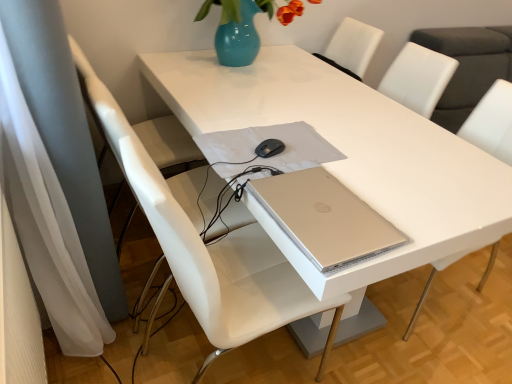
Question: Is white glossy table at center oriented towards white leather chair at center, marked as the second chair in a right-to-left arrangement?

Choices:
 (A) yes
 (B) no

Answer: (B)

Question: From a real-world perspective, is white glossy table at center positioned over white leather chair at center, the first chair viewed from the left, based on gravity?

Choices:
 (A) yes
 (B) no

Answer: (B)

Question: Is white glossy table at center in contact with white leather chair at center, marked as the second chair in a right-to-left arrangement?

Choices:
 (A) no
 (B) yes

Answer: (A)

Question: From a real-world perspective, is white glossy table at center positioned under white leather chair at center, the first chair viewed from the left, based on gravity?

Choices:
 (A) no
 (B) yes

Answer: (B)

Question: Is white glossy table at center oriented away from white leather chair at center, the first chair viewed from the left?

Choices:
 (A) yes
 (B) no

Answer: (B)

Question: Looking at the image, does white leather chair at center, placed as the 2th chair when sorted from left to right, seem bigger or smaller compared to white leather chair at center, the first chair viewed from the left?

Choices:
 (A) small
 (B) big

Answer: (B)

Question: Considering their positions, is white leather chair at center, which appears as the 1th chair when viewed from the right, located in front of or behind white leather chair at center, marked as the second chair in a right-to-left arrangement?

Choices:
 (A) front
 (B) behind

Answer: (B)

Question: From a real-world perspective, relative to white leather chair at center, the first chair viewed from the left, is white leather chair at center, which appears as the 1th chair when viewed from the right, vertically above or below?

Choices:
 (A) above
 (B) below

Answer: (B)

Question: Is white leather chair at center, which appears as the 1th chair when viewed from the right, inside the boundaries of white leather chair at center, marked as the second chair in a right-to-left arrangement, or outside?

Choices:
 (A) inside
 (B) outside

Answer: (B)

Question: From the image's perspective, relative to white plastic swivel chair at left, is white leather chair at center, the first chair viewed from the left, above or below?

Choices:
 (A) above
 (B) below

Answer: (B)

Question: In terms of width, does white leather chair at center, the first chair viewed from the left, look wider or thinner when compared to white plastic swivel chair at left?

Choices:
 (A) wide
 (B) thin

Answer: (B)

Question: Considering the positions of white leather chair at center, the first chair viewed from the left, and white plastic swivel chair at left in the image, is white leather chair at center, the first chair viewed from the left, taller or shorter than white plastic swivel chair at left?

Choices:
 (A) short
 (B) tall

Answer: (A)

Question: From a real-world perspective, is white leather chair at center, the first chair viewed from the left, positioned above or below white plastic swivel chair at left?

Choices:
 (A) below
 (B) above

Answer: (A)

Question: Considering the positions of white leather chair at center, which appears as the 1th chair when viewed from the right, and white glossy table at center in the image, is white leather chair at center, which appears as the 1th chair when viewed from the right, wider or thinner than white glossy table at center?

Choices:
 (A) wide
 (B) thin

Answer: (B)

Question: From the image's perspective, is white leather chair at center, placed as the 2th chair when sorted from left to right, located above or below white glossy table at center?

Choices:
 (A) below
 (B) above

Answer: (A)